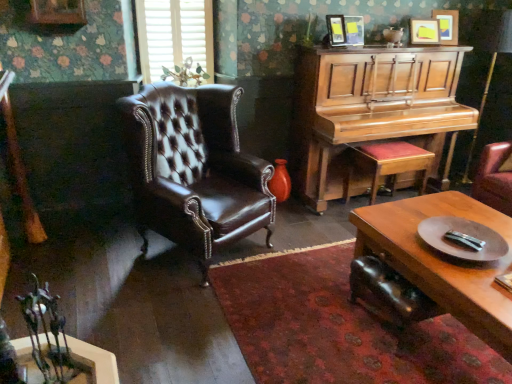
Find the location of a particular element. This screenshot has width=512, height=384. free space that is to the left of brown leather chair at left is located at coordinates (98, 255).